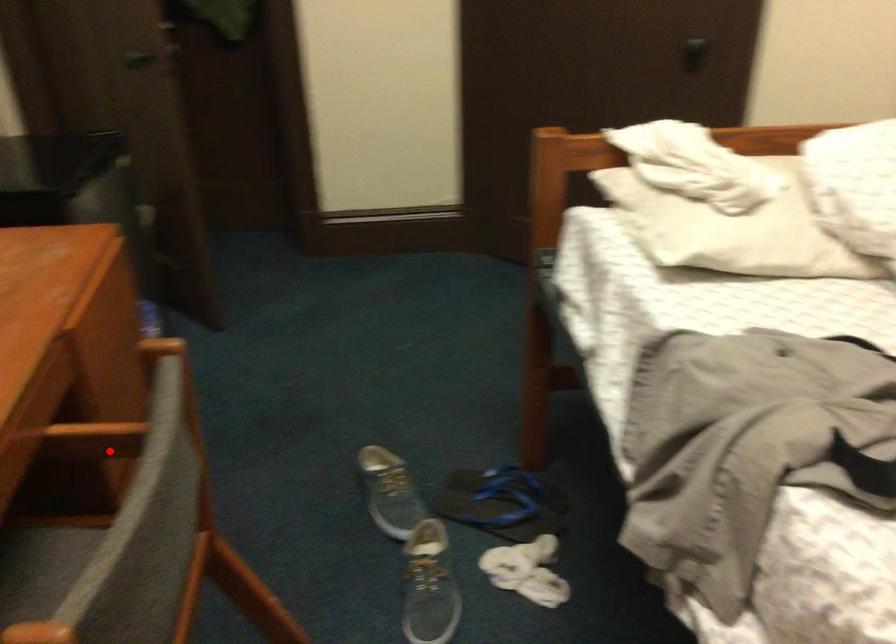
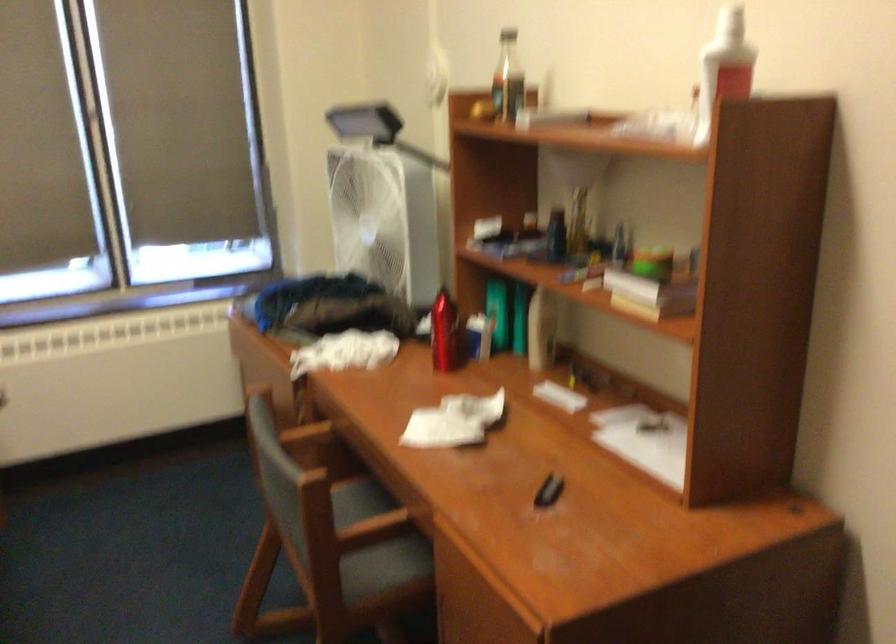
Where in the second image is the point corresponding to the highlighted location from the first image?

(375, 545)